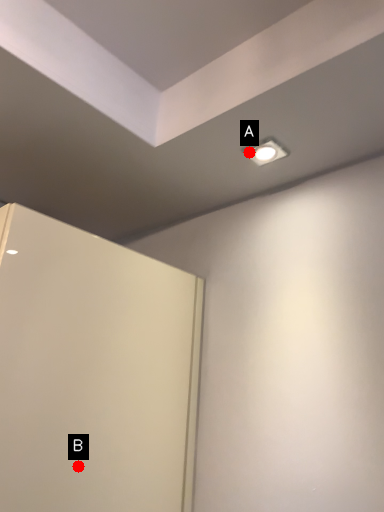
Question: Two points are circled on the image, labeled by A and B beside each circle. Which point appears closest to the camera in this image?

Choices:
 (A) A is closer
 (B) B is closer

Answer: (B)